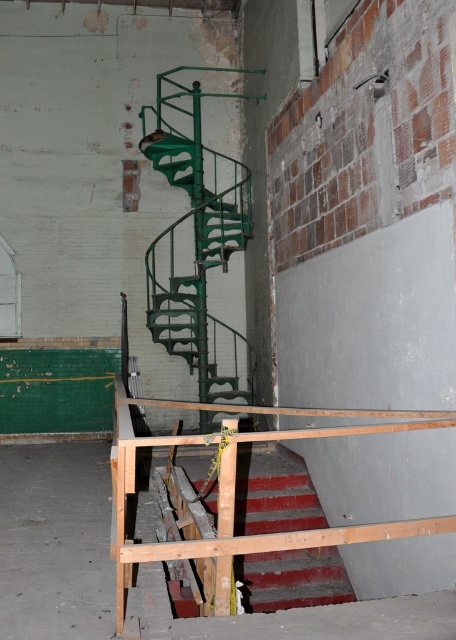
Does point (208, 419) lie in front of point (309, 483)?

No.

From the picture: Can you confirm if green matte spiral staircase at center is wider than red textured stair at lower center?

Indeed, green matte spiral staircase at center has a greater width compared to red textured stair at lower center.

Identify the location of green matte spiral staircase at center. (196, 236).